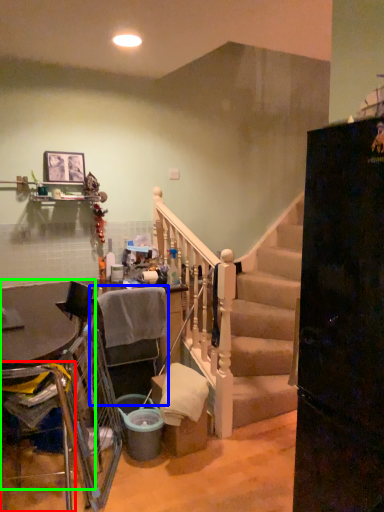
Question: Which object is the closest to the armchair (highlighted by a red box)? Choose among these: armchair (highlighted by a blue box) or table (highlighted by a green box).

Choices:
 (A) armchair
 (B) table

Answer: (B)